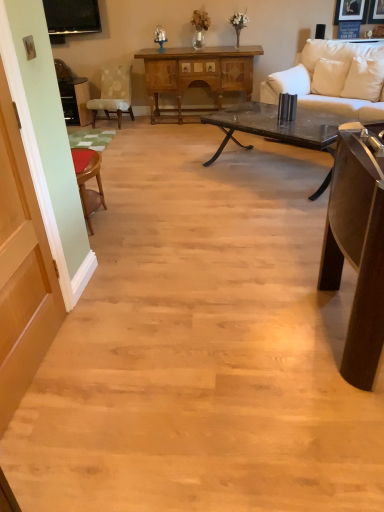
Question: From the image's perspective, is white leather pillow at upper right, which ranks as the 1th pillow in right-to-left order, beneath dark brown wood table at right, acting as the first table starting from the bottom?

Choices:
 (A) yes
 (B) no

Answer: (B)

Question: Does white leather pillow at upper right, which ranks as the 1th pillow in right-to-left order, have a lesser height compared to dark brown wood table at right, which is the 1th table from front to back?

Choices:
 (A) yes
 (B) no

Answer: (A)

Question: Is white leather pillow at upper right, which ranks as the 1th pillow in right-to-left order, oriented away from dark brown wood table at right, acting as the first table starting from the bottom?

Choices:
 (A) no
 (B) yes

Answer: (A)

Question: Is white leather pillow at upper right, marked as the third pillow in a left-to-right arrangement, closer to the viewer compared to dark brown wood table at right, which is the 1th table from front to back?

Choices:
 (A) yes
 (B) no

Answer: (B)

Question: Is white leather pillow at upper right, which ranks as the 1th pillow in right-to-left order, beside dark brown wood table at right, which is the third table in top-to-bottom order?

Choices:
 (A) yes
 (B) no

Answer: (B)

Question: Can you confirm if white leather pillow at upper right, which ranks as the 1th pillow in right-to-left order, is thinner than dark brown wood table at right, placed as the 3th table when sorted from back to front?

Choices:
 (A) yes
 (B) no

Answer: (A)

Question: Is wooden cabinet at center, which ranks as the 1th table in top-to-bottom order, positioned beyond the bounds of white leather couch at upper right?

Choices:
 (A) no
 (B) yes

Answer: (B)

Question: From the image's perspective, would you say wooden cabinet at center, which ranks as the 1th table in top-to-bottom order, is shown under white leather couch at upper right?

Choices:
 (A) yes
 (B) no

Answer: (B)

Question: Does wooden cabinet at center, which is counted as the 2th table, starting from the back, turn towards white leather couch at upper right?

Choices:
 (A) no
 (B) yes

Answer: (A)

Question: Can you confirm if wooden cabinet at center, the 2th table viewed from the left, is smaller than white leather couch at upper right?

Choices:
 (A) yes
 (B) no

Answer: (A)

Question: From a real-world perspective, is wooden cabinet at center, which is counted as the 2th table, starting from the back, under white leather couch at upper right?

Choices:
 (A) no
 (B) yes

Answer: (B)

Question: Is wooden cabinet at center, the third table ordered from the bottom, oriented away from white leather couch at upper right?

Choices:
 (A) no
 (B) yes

Answer: (A)

Question: Is light beige fabric chair at left at the right side of white leather couch at upper right?

Choices:
 (A) no
 (B) yes

Answer: (A)